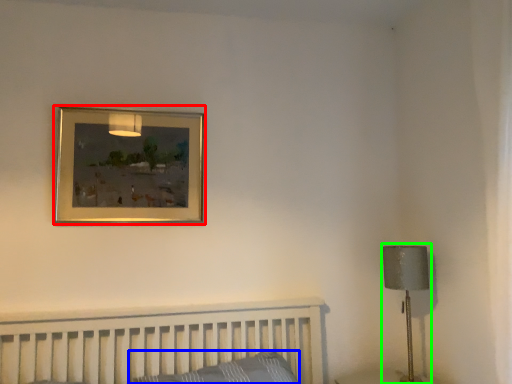
Question: Which is nearer to the picture frame (highlighted by a red box)? pillow (highlighted by a blue box) or table lamp (highlighted by a green box).

Choices:
 (A) pillow
 (B) table lamp

Answer: (A)